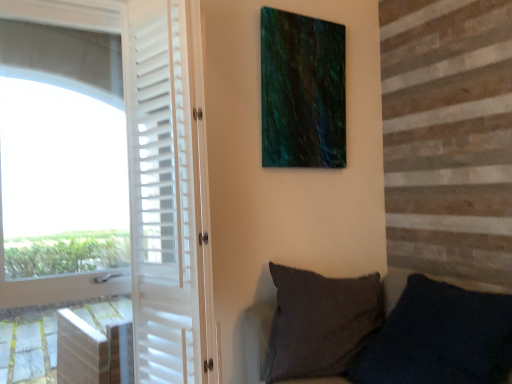
Question: Is green textured canvas at upper center closer to camera compared to white matte screen door at left?

Choices:
 (A) no
 (B) yes

Answer: (A)

Question: Does green textured canvas at upper center turn towards white matte screen door at left?

Choices:
 (A) no
 (B) yes

Answer: (A)

Question: Would you say green textured canvas at upper center is outside white matte screen door at left?

Choices:
 (A) no
 (B) yes

Answer: (B)

Question: Can white matte screen door at left be found inside green textured canvas at upper center?

Choices:
 (A) no
 (B) yes

Answer: (A)

Question: Is green textured canvas at upper center wider than white matte screen door at left?

Choices:
 (A) no
 (B) yes

Answer: (A)

Question: Is green textured canvas at upper center behind white matte screen door at left?

Choices:
 (A) yes
 (B) no

Answer: (A)

Question: From the image's perspective, is white matte screen door at left located above green textured canvas at upper center?

Choices:
 (A) no
 (B) yes

Answer: (A)

Question: From a real-world perspective, does white matte screen door at left sit lower than green textured canvas at upper center?

Choices:
 (A) yes
 (B) no

Answer: (A)

Question: Is white matte screen door at left outside of green textured canvas at upper center?

Choices:
 (A) yes
 (B) no

Answer: (A)

Question: Can you confirm if white matte screen door at left is taller than green textured canvas at upper center?

Choices:
 (A) yes
 (B) no

Answer: (A)

Question: Can you confirm if white matte screen door at left is thinner than green textured canvas at upper center?

Choices:
 (A) no
 (B) yes

Answer: (A)

Question: Is green textured canvas at upper center inside white matte screen door at left?

Choices:
 (A) no
 (B) yes

Answer: (A)

Question: Is dark gray fabric pillow at lower right beside white matte screen door at left?

Choices:
 (A) no
 (B) yes

Answer: (A)